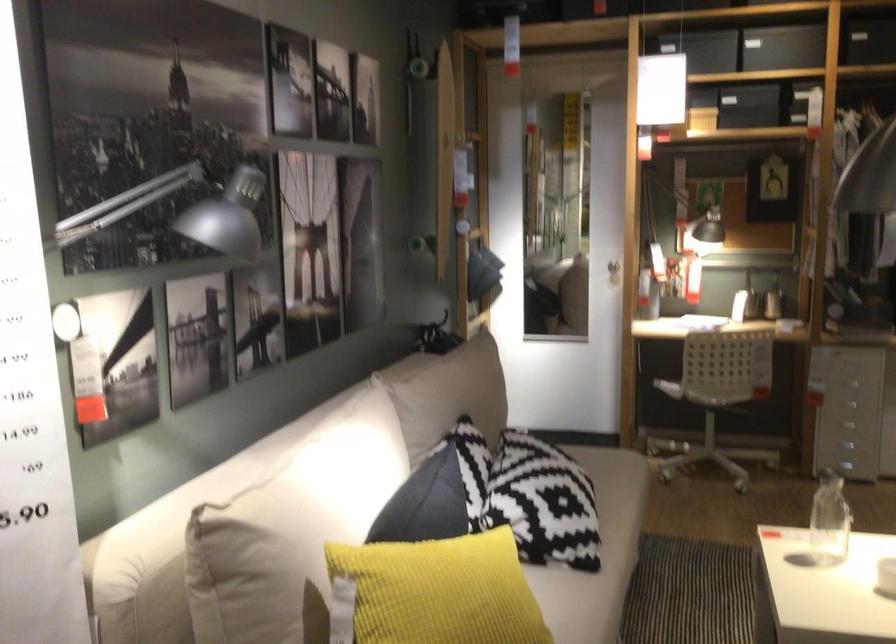
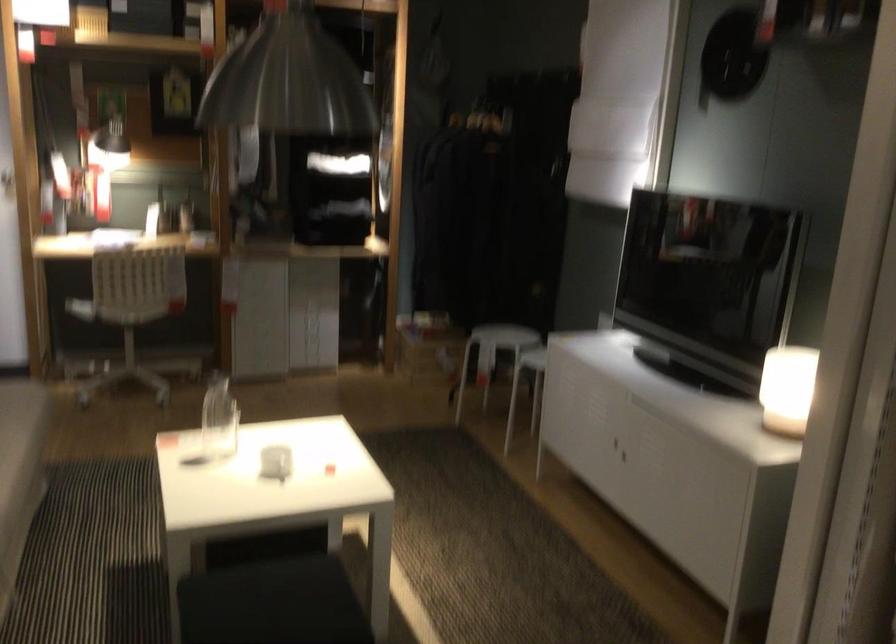
The point at (682, 375) is marked in the first image. Where is the corresponding point in the second image?

(80, 308)